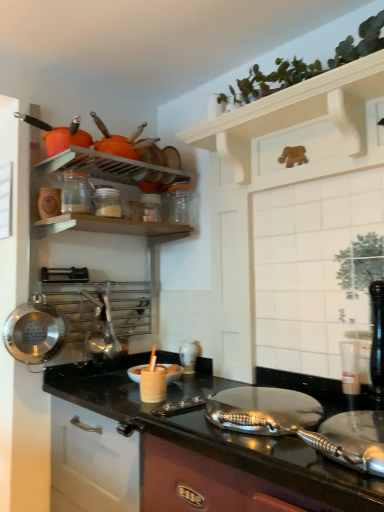
How much space does clear glass jar at upper center, acting as the 2th appliance starting from the right, occupy vertically?

The height of clear glass jar at upper center, acting as the 2th appliance starting from the right, is 4.57 inches.

At what (x,y) coordinates should I click in order to perform the action: click on clear glass jar at upper center, acting as the 2th appliance starting from the right. Please return your answer as a coordinate pair (x, y). The height and width of the screenshot is (512, 384). Looking at the image, I should click on (107, 202).

The height and width of the screenshot is (512, 384). What do you see at coordinates (76, 193) in the screenshot? I see `clear glass jar at upper left, the first appliance viewed from the left` at bounding box center [76, 193].

In order to face white wooden shelf at upper center, should I rotate leftwards or rightwards?

It's best to rotate right around 10.867 degrees.

What is the approximate width of polished stainless steel wok at left?

5.61 inches.

At what (x,y) coordinates should I click in order to perform the action: click on white glossy vase at center, which ranks as the third appliance in left-to-right order. Please return your answer as a coordinate pair (x, y). The image size is (384, 512). Looking at the image, I should click on (189, 355).

Is polished stainless steel wok at left turned away from clear glass jar at upper left, which appears as the third appliance when viewed from the back?

polished stainless steel wok at left is not turned away from clear glass jar at upper left, which appears as the third appliance when viewed from the back.

From a real-world perspective, is polished stainless steel wok at left over clear glass jar at upper left, arranged as the 3th appliance when viewed from the right?

No, from a real-world perspective, polished stainless steel wok at left is not over clear glass jar at upper left, arranged as the 3th appliance when viewed from the right

Looking at the image, does polished stainless steel wok at left seem bigger or smaller compared to clear glass jar at upper left, which appears as the third appliance when viewed from the back?

In the image, polished stainless steel wok at left appears to be larger than clear glass jar at upper left, which appears as the third appliance when viewed from the back.

Can you confirm if polished stainless steel wok at left is wider than clear glass jar at upper left, marked as the first appliance in a front-to-back arrangement?

Correct, the width of polished stainless steel wok at left exceeds that of clear glass jar at upper left, marked as the first appliance in a front-to-back arrangement.

How much distance is there between white glossy vase at center, positioned as the 3th appliance in front-to-back order, and metallic black countertop at center?

white glossy vase at center, positioned as the 3th appliance in front-to-back order, and metallic black countertop at center are 47.32 centimeters apart.

Does white glossy vase at center, which ranks as the third appliance in left-to-right order, appear on the right side of metallic black countertop at center?

No, white glossy vase at center, which ranks as the third appliance in left-to-right order, is not to the right of metallic black countertop at center.

From the image's perspective, does white glossy vase at center, which ranks as the third appliance in left-to-right order, appear higher than metallic black countertop at center?

Yes, from the image's perspective, white glossy vase at center, which ranks as the third appliance in left-to-right order, is above metallic black countertop at center.

Between white glossy vase at center, marked as the 1th appliance in a back-to-front arrangement, and metallic black countertop at center, which one has smaller width?

white glossy vase at center, marked as the 1th appliance in a back-to-front arrangement.

Considering the sizes of objects metallic black countertop at center and clear glass jar at upper center, acting as the 2th appliance starting from the right, in the image provided, who is taller, metallic black countertop at center or clear glass jar at upper center, acting as the 2th appliance starting from the right,?

metallic black countertop at center.

Looking at this image, could you tell me if metallic black countertop at center is facing clear glass jar at upper center, positioned as the 2th appliance in front-to-back order?

No, metallic black countertop at center is not turned towards clear glass jar at upper center, positioned as the 2th appliance in front-to-back order.

Find the location of a particular element. countertop below the clear glass jar at upper center, which is the 2th appliance in bottom-to-top order (from a real-world perspective) is located at coordinates (210, 444).

Who is bigger, white wooden shelf at upper center or polished stainless steel wok at left?

white wooden shelf at upper center is bigger.

What's the angular difference between white wooden shelf at upper center and polished stainless steel wok at left's facing directions?

The angular difference between white wooden shelf at upper center and polished stainless steel wok at left is 82.7 degrees.

Can you confirm if white wooden shelf at upper center is taller than polished stainless steel wok at left?

Incorrect, the height of white wooden shelf at upper center is not larger of that of polished stainless steel wok at left.

Is clear glass jar at upper center, placed as the 2th appliance when sorted from back to front, facing towards clear glass jar at upper left, which appears as the third appliance when viewed from the back?

No, clear glass jar at upper center, placed as the 2th appliance when sorted from back to front, is not aimed at clear glass jar at upper left, which appears as the third appliance when viewed from the back.

Is clear glass jar at upper center, acting as the 2th appliance starting from the right, further to camera compared to clear glass jar at upper left, arranged as the 3th appliance when viewed from the right?

Yes, it is behind clear glass jar at upper left, arranged as the 3th appliance when viewed from the right.

Are clear glass jar at upper left, arranged as the 3th appliance when ordered from the bottom, and white wooden shelf at upper center far apart?

No, clear glass jar at upper left, arranged as the 3th appliance when ordered from the bottom, is not far away from white wooden shelf at upper center.

From the image's perspective, does clear glass jar at upper left, which appears as the third appliance when viewed from the back, appear lower than white wooden shelf at upper center?

Yes, from the image's perspective, clear glass jar at upper left, which appears as the third appliance when viewed from the back, is below white wooden shelf at upper center.

Which of these two, clear glass jar at upper left, the first appliance viewed from the left, or white wooden shelf at upper center, stands taller?

Standing taller between the two is white wooden shelf at upper center.

Is the position of green leafy plant at upper right less distant than that of polished stainless steel wok at left?

Yes, it is.

Which object is wider, green leafy plant at upper right or polished stainless steel wok at left?

green leafy plant at upper right is wider.

You are a GUI agent. You are given a task and a screenshot of the screen. Output one action in this format:
    pyautogui.click(x=<x>, y=<y>)
    Task: Click on the plant above the polished stainless steel wok at left (from a real-world perspective)
    The width and height of the screenshot is (384, 512).
    Given the screenshot: What is the action you would take?
    pyautogui.click(x=308, y=64)

Where is `wok in front of the clear glass jar at upper left, the first appliance viewed from the left`? wok in front of the clear glass jar at upper left, the first appliance viewed from the left is located at coordinates (35, 331).

The height and width of the screenshot is (512, 384). I want to click on countertop to the right of white glossy vase at center, which ranks as the 1th appliance in bottom-to-top order, so click(210, 444).

Which object lies nearer to the anchor point clear glass jar at upper center, placed as the 2th appliance when sorted from back to front, metallic black countertop at center or green leafy plant at upper right?

The object closer to clear glass jar at upper center, placed as the 2th appliance when sorted from back to front, is green leafy plant at upper right.

Looking at the image, which one is located further to clear glass jar at upper center, positioned as the 2th appliance in front-to-back order, white glossy vase at center, which ranks as the 1th appliance in bottom-to-top order, or clear glass jar at upper left, arranged as the 3th appliance when ordered from the bottom?

white glossy vase at center, which ranks as the 1th appliance in bottom-to-top order, is further to clear glass jar at upper center, positioned as the 2th appliance in front-to-back order.

Looking at the image, which one is located further to green leafy plant at upper right, white glossy vase at center, marked as the first appliance in a right-to-left arrangement, or white wooden shelf at upper center?

The object further to green leafy plant at upper right is white glossy vase at center, marked as the first appliance in a right-to-left arrangement.

Looking at this image, estimate the real-world distances between objects in this image. Which object is further from polished stainless steel wok at left, white glossy vase at center, which ranks as the third appliance in left-to-right order, or metallic black countertop at center?

white glossy vase at center, which ranks as the third appliance in left-to-right order.

Estimate the real-world distances between objects in this image. Which object is further from white wooden shelf at upper center, white glossy vase at center, which ranks as the third appliance in left-to-right order, or clear glass jar at upper left, arranged as the 3th appliance when viewed from the right?

white glossy vase at center, which ranks as the third appliance in left-to-right order, is positioned further to the anchor white wooden shelf at upper center.

Estimate the real-world distances between objects in this image. Which object is further from white wooden shelf at upper center, polished stainless steel wok at left or metallic black countertop at center?

polished stainless steel wok at left is positioned further to the anchor white wooden shelf at upper center.

Looking at the image, which one is located further to white wooden shelf at upper center, clear glass jar at upper center, positioned as the 2th appliance in front-to-back order, or polished stainless steel wok at left?

Among the two, polished stainless steel wok at left is located further to white wooden shelf at upper center.

Based on their spatial positions, is polished stainless steel wok at left or metallic black countertop at center further from clear glass jar at upper center, which is the 2th appliance in bottom-to-top order?

Answer: The object further to clear glass jar at upper center, which is the 2th appliance in bottom-to-top order, is metallic black countertop at center.

Find the location of a particular element. The height and width of the screenshot is (512, 384). shelf situated between clear glass jar at upper center, which is the 2th appliance in top-to-bottom order, and green leafy plant at upper right from left to right is located at coordinates (296, 113).

At what (x,y) coordinates should I click in order to perform the action: click on shelf situated between polished stainless steel wok at left and green leafy plant at upper right from left to right. Please return your answer as a coordinate pair (x, y). Looking at the image, I should click on (296, 113).

Locate an element on the screen. This screenshot has width=384, height=512. wok between white wooden shelf at upper center and metallic black countertop at center from top to bottom is located at coordinates (35, 331).

The image size is (384, 512). I want to click on wok between metallic black countertop at center and clear glass jar at upper left, which appears as the third appliance when viewed from the back, along the z-axis, so click(x=35, y=331).